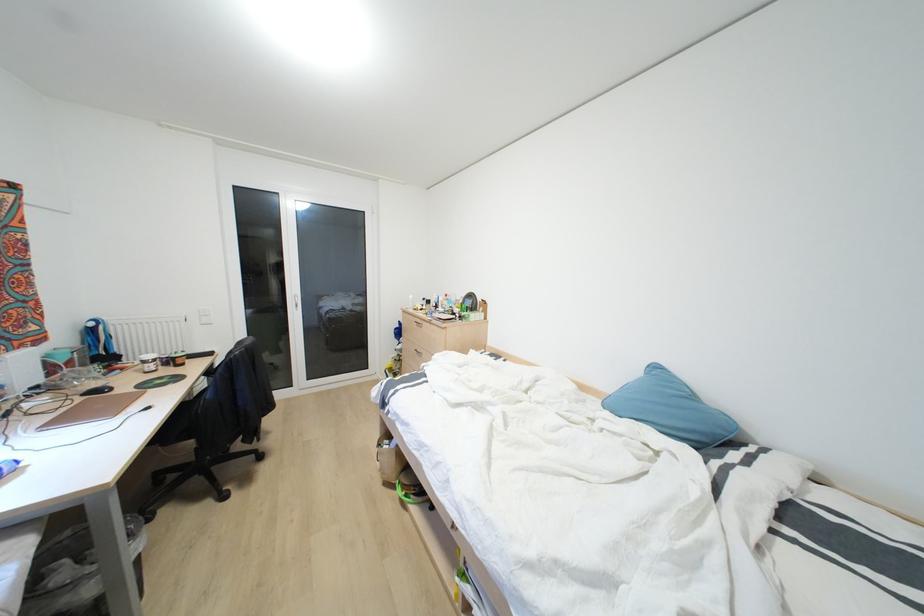
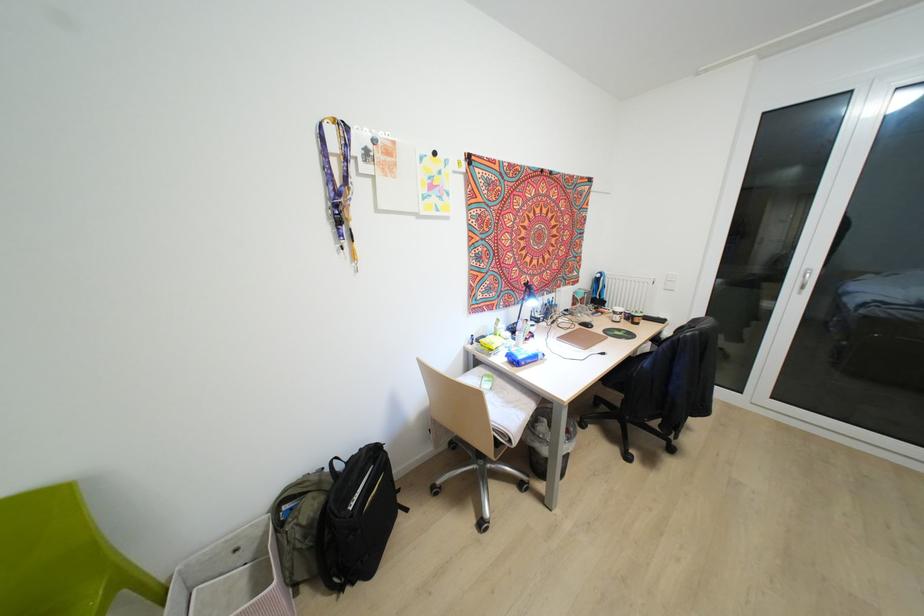
Where in the second image is the point corresponding to [181,363] from the first image?

(637, 323)